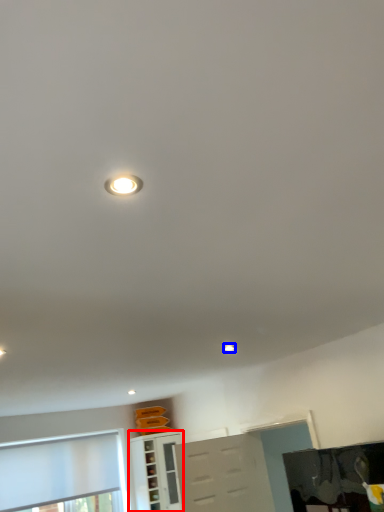
Question: Which object is further to the camera taking this photo, cabinetry (highlighted by a red box) or droplight (highlighted by a blue box)?

Choices:
 (A) cabinetry
 (B) droplight

Answer: (A)